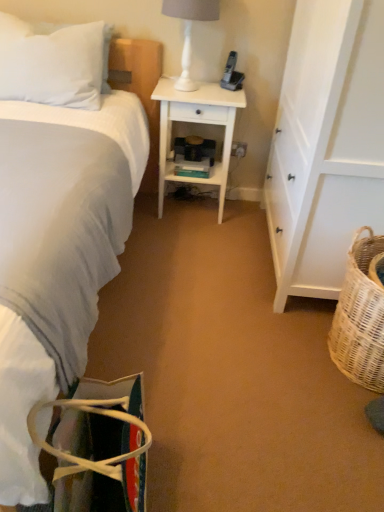
Question: Relative to black plastic phone at upper center, is white wood desk at center in front or behind?

Choices:
 (A) behind
 (B) front

Answer: (B)

Question: Based on their positions, is white wood desk at center located to the left or right of black plastic phone at upper center?

Choices:
 (A) right
 (B) left

Answer: (B)

Question: Estimate the real-world distances between objects in this image. Which object is closer to the white glossy lamp at upper center?

Choices:
 (A) white plastic electric outlet at center
 (B) black plastic phone at upper center
 (C) woven wicker basket at lower right
 (D) white soft pillow at upper left
 (E) white wood cabinet at right

Answer: (B)

Question: Estimate the real-world distances between objects in this image. Which object is farther from the white wood desk at center?

Choices:
 (A) white soft bed at left
 (B) multicolored fabric bag at lower left
 (C) white wood cabinet at right
 (D) white plastic electric outlet at center
 (E) white soft pillow at upper left

Answer: (B)